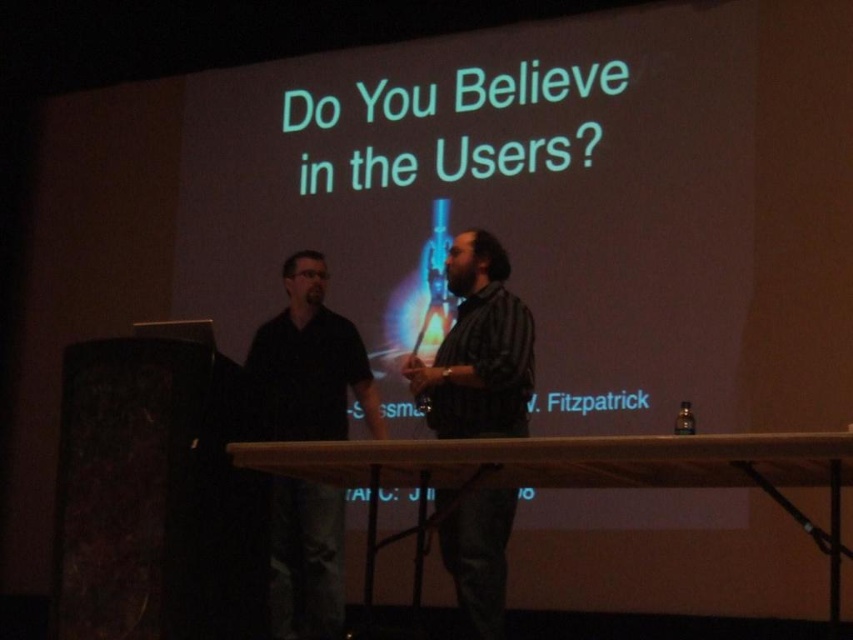
You are a stagehand setting up for a presentation. The white matte projection screen at upper center needs to be moved closer to the black matte shirt at left. How much closer should you move it to ensure it is exactly 5 meters away?

The white matte projection screen at upper center is currently 8.26 meters away from the black matte shirt at left. To make it exactly 5 meters away, you should move it closer by 3.26 meters.

You are an event planner setting up for a presentation. You need to place a decorative item at the point with coordinates point (498, 200). According to the scene, where exactly on the screen should you place it?

The point (498, 200) is located on the white matte projection screen at upper center, so you should place the decorative item on the upper center area of the screen.